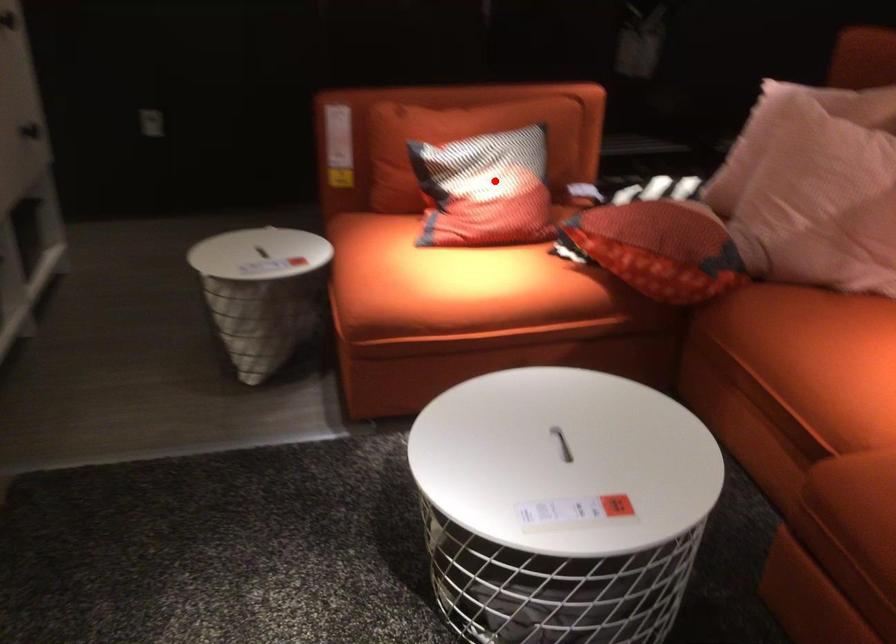
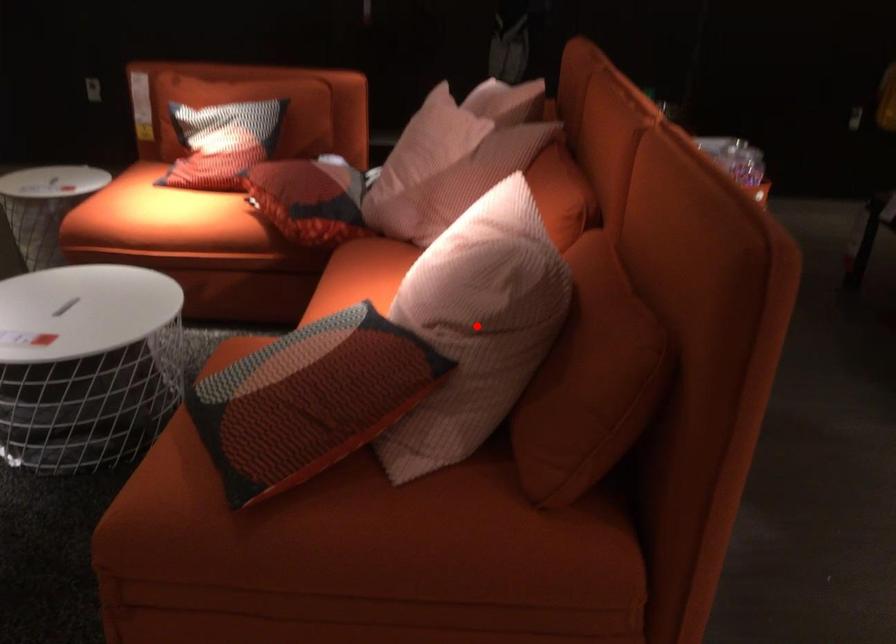
I am providing you with two images of the same scene from different viewpoints. A red point is marked on the first image and another point is marked on the second image. Is the marked point in image1 the same physical position as the marked point in image2?

No